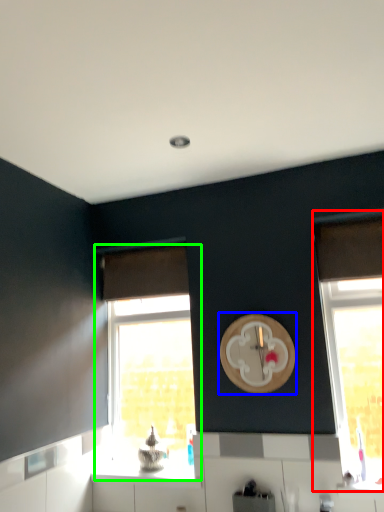
Question: Which object is the farthest from window (highlighted by a red box)? Choose among these: clock (highlighted by a blue box) or window (highlighted by a green box).

Choices:
 (A) clock
 (B) window

Answer: (B)